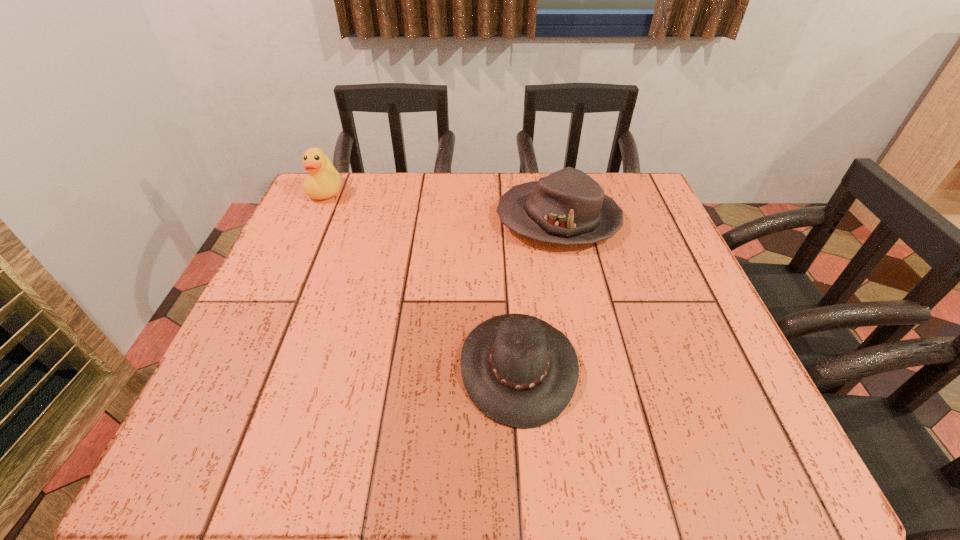
Where is `vacant space located on the front-facing side of the nearest object`? This screenshot has height=540, width=960. vacant space located on the front-facing side of the nearest object is located at coordinates (260, 366).

The image size is (960, 540). What are the coordinates of `blank area located 0.150m on the front-facing side of the nearest object` in the screenshot? It's located at (377, 366).

Where is `duck at the far edge`? duck at the far edge is located at coordinates (323, 182).

The image size is (960, 540). I want to click on hat located in the far edge section of the desktop, so click(568, 207).

Identify the location of object that is positioned at the near edge. The width and height of the screenshot is (960, 540). (520, 371).

At what (x,y) coordinates should I click in order to perform the action: click on object at the left edge. Please return your answer as a coordinate pair (x, y). This screenshot has width=960, height=540. Looking at the image, I should click on (323, 182).

I want to click on object that is at the right edge, so click(x=568, y=207).

Where is `object present at the far left corner`? object present at the far left corner is located at coordinates (323, 182).

Where is `object that is positioned at the far right corner`? object that is positioned at the far right corner is located at coordinates (568, 207).

Locate an element on the screen. The height and width of the screenshot is (540, 960). vacant space at the far edge of the desktop is located at coordinates (479, 188).